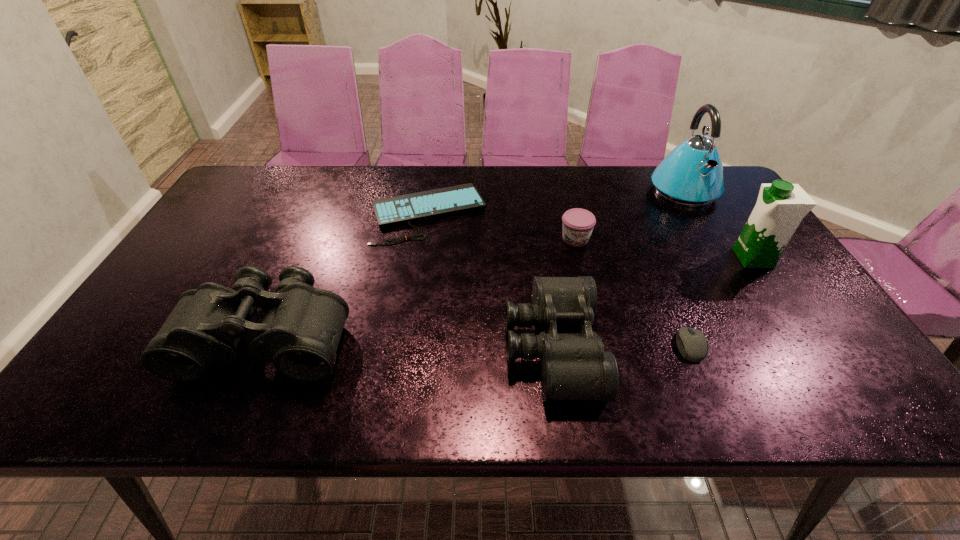
At what (x,y) coordinates should I click in order to perform the action: click on computer equipment positioned at the near edge. Please return your answer as a coordinate pair (x, y). Looking at the image, I should click on (692, 343).

I want to click on object that is at the left edge, so click(300, 332).

Identify the location of kettle that is at the right edge. (691, 175).

You are a GUI agent. You are given a task and a screenshot of the screen. Output one action in this format:
    pyautogui.click(x=<x>, y=<y>)
    Task: Click on the soya milk present at the right edge
    
    Given the screenshot: What is the action you would take?
    pyautogui.click(x=781, y=206)

Image resolution: width=960 pixels, height=540 pixels. In order to click on object that is at the near left corner in this screenshot , I will do `click(300, 332)`.

This screenshot has height=540, width=960. Identify the location of object that is at the far right corner. (691, 175).

Find the location of a particular element. free location at the far edge of the desktop is located at coordinates (529, 193).

Locate an element on the screen. The image size is (960, 540). vacant area at the near edge is located at coordinates (714, 361).

At what (x,y) coordinates should I click in order to perform the action: click on blank space at the right edge of the desktop. Please return your answer as a coordinate pair (x, y). The height and width of the screenshot is (540, 960). Looking at the image, I should click on (760, 289).

In the image, there is a desktop. Where is `vacant space at the far left corner`? vacant space at the far left corner is located at coordinates (261, 167).